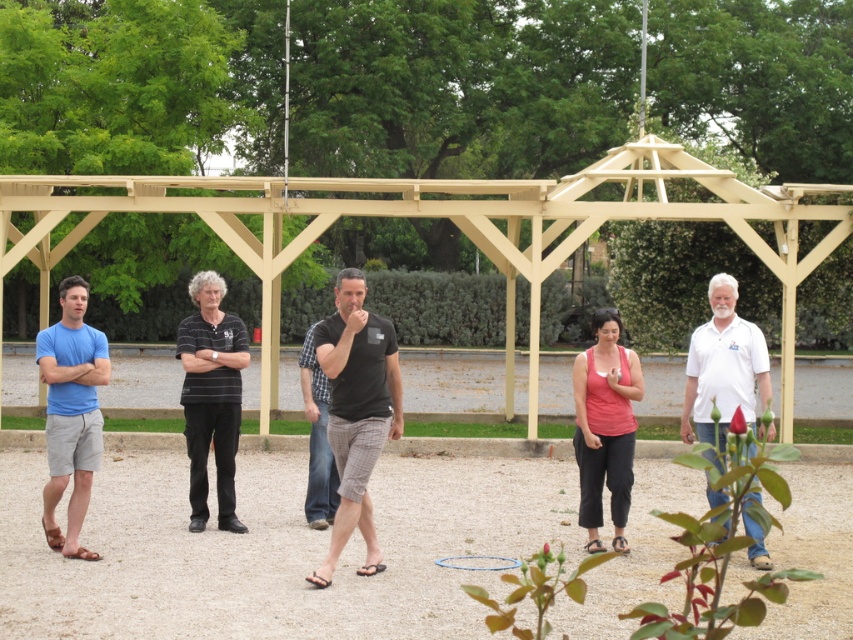
You are standing at the center of the pergola and want to locate the pink fabric tank top at center. Based on the coordinates provided, in which direction should you look relative to your current position?

The pink fabric tank top at center is located at coordinates point (605,426), which is to the lower right direction from your current position at the center of the pergola.